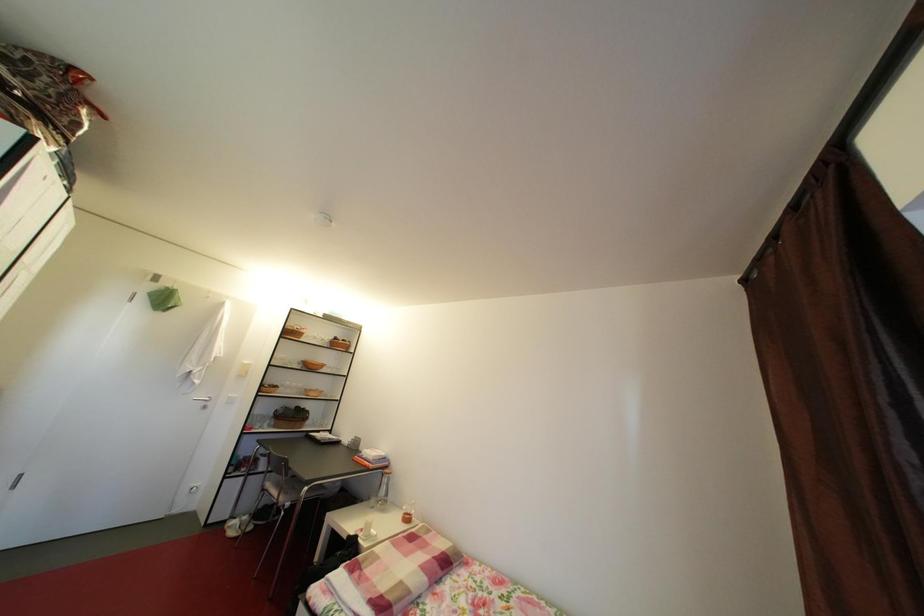
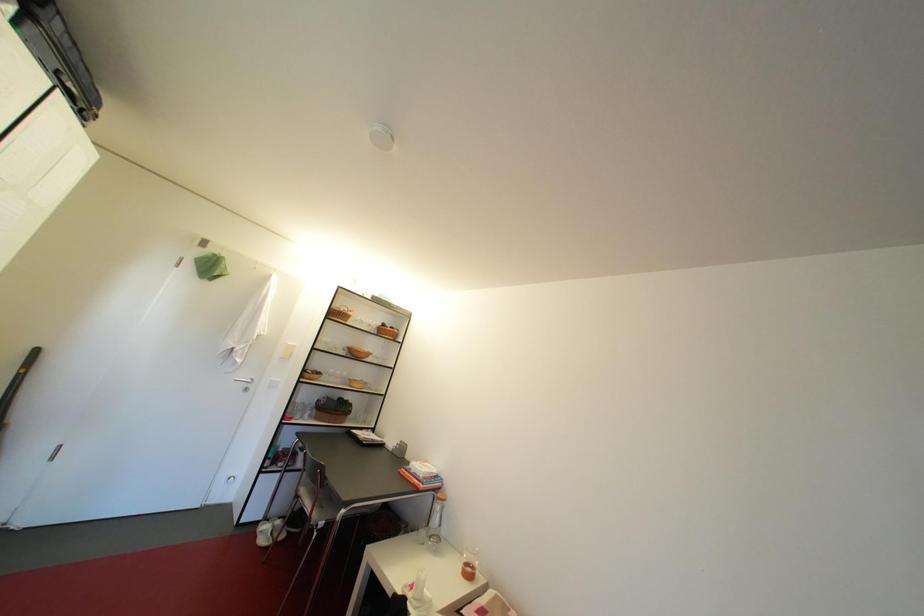
Question: The camera is either moving clockwise (left) or counter-clockwise (right) around the object. The first image is from the beginning of the video and the second image is from the end. Is the camera moving left or right when shooting the video?

Choices:
 (A) Left
 (B) Right

Answer: (B)